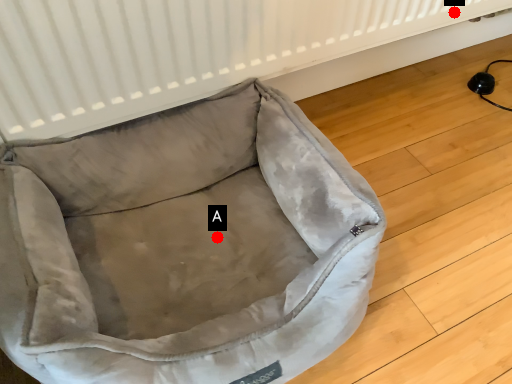
Question: Two points are circled on the image, labeled by A and B beside each circle. Among these points, which one is nearest to the camera?

Choices:
 (A) A is closer
 (B) B is closer

Answer: (A)